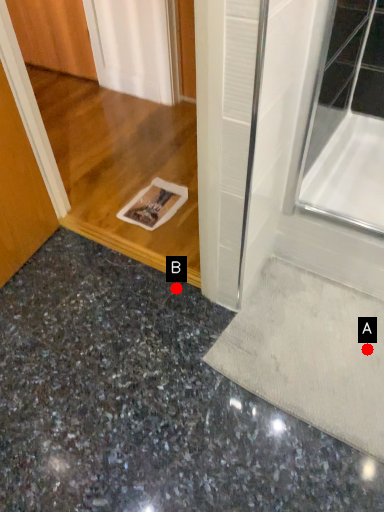
Question: Two points are circled on the image, labeled by A and B beside each circle. Among these points, which one is farthest from the camera?

Choices:
 (A) A is further
 (B) B is further

Answer: (B)